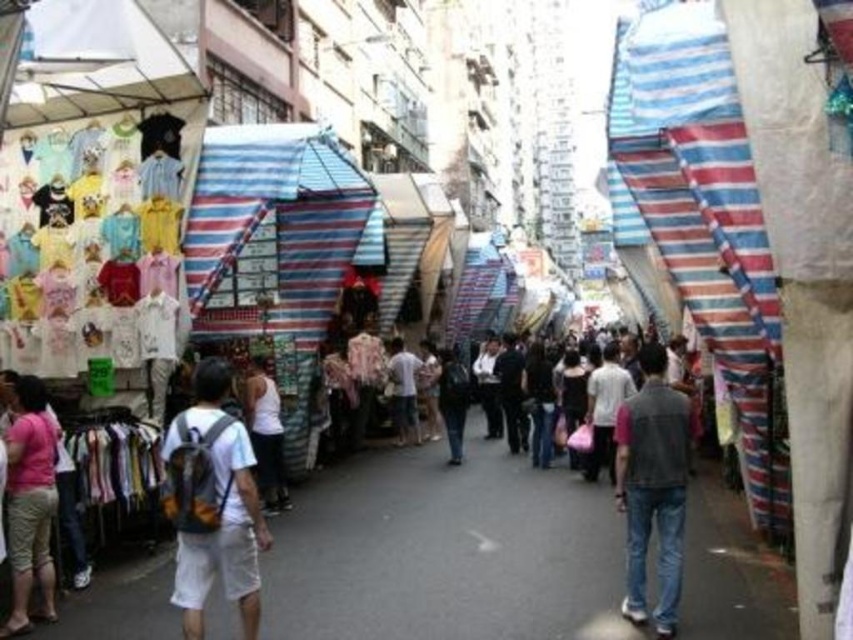
Question: Does white fabric backpack at center appear under white matte tank top at center?

Choices:
 (A) yes
 (B) no

Answer: (A)

Question: Estimate the real-world distances between objects in this image. Which object is farther from the white fabric backpack at center?

Choices:
 (A) pink fabric shorts at lower left
 (B) denim jeans at center

Answer: (B)

Question: Which object is closer to the camera taking this photo?

Choices:
 (A) pink fabric shorts at lower left
 (B) white fabric backpack at center
 (C) white matte tank top at center
 (D) denim jeans at center

Answer: (B)

Question: Which point is farther from the camera taking this photo?

Choices:
 (A) (248, 454)
 (B) (28, 566)

Answer: (A)

Question: Is denim jeans at center smaller than white matte tank top at center?

Choices:
 (A) no
 (B) yes

Answer: (A)

Question: Is white fabric backpack at center further to the viewer compared to white matte tank top at center?

Choices:
 (A) no
 (B) yes

Answer: (A)